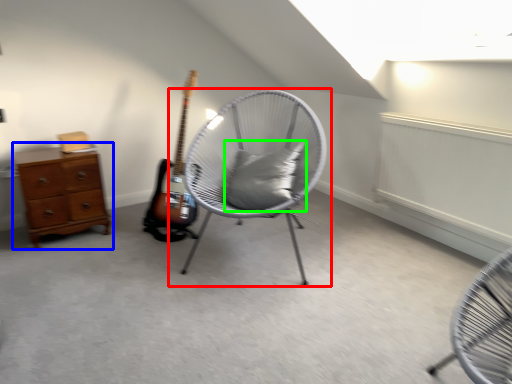
Question: Based on their relative distances, which object is nearer to chair (highlighted by a red box)? Choose from chest of drawers (highlighted by a blue box) and pillow (highlighted by a green box).

Choices:
 (A) chest of drawers
 (B) pillow

Answer: (B)